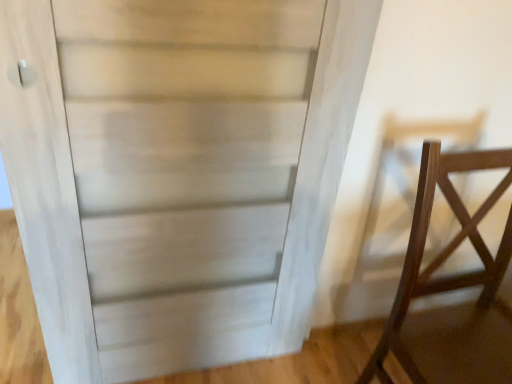
Question: From a real-world perspective, relative to dark wood chair at right, is white wood door at center vertically above or below?

Choices:
 (A) below
 (B) above

Answer: (B)

Question: Looking at their shapes, would you say white wood door at center is wider or thinner than dark wood chair at right?

Choices:
 (A) wide
 (B) thin

Answer: (B)

Question: Is white wood door at center inside or outside of dark wood chair at right?

Choices:
 (A) inside
 (B) outside

Answer: (B)

Question: Is dark wood chair at right situated inside white wood door at center or outside?

Choices:
 (A) outside
 (B) inside

Answer: (A)

Question: Considering the positions of dark wood chair at right and white wood door at center in the image, is dark wood chair at right bigger or smaller than white wood door at center?

Choices:
 (A) small
 (B) big

Answer: (B)

Question: From a real-world perspective, is dark wood chair at right above or below white wood door at center?

Choices:
 (A) above
 (B) below

Answer: (B)

Question: In terms of height, does dark wood chair at right look taller or shorter compared to white wood door at center?

Choices:
 (A) tall
 (B) short

Answer: (B)